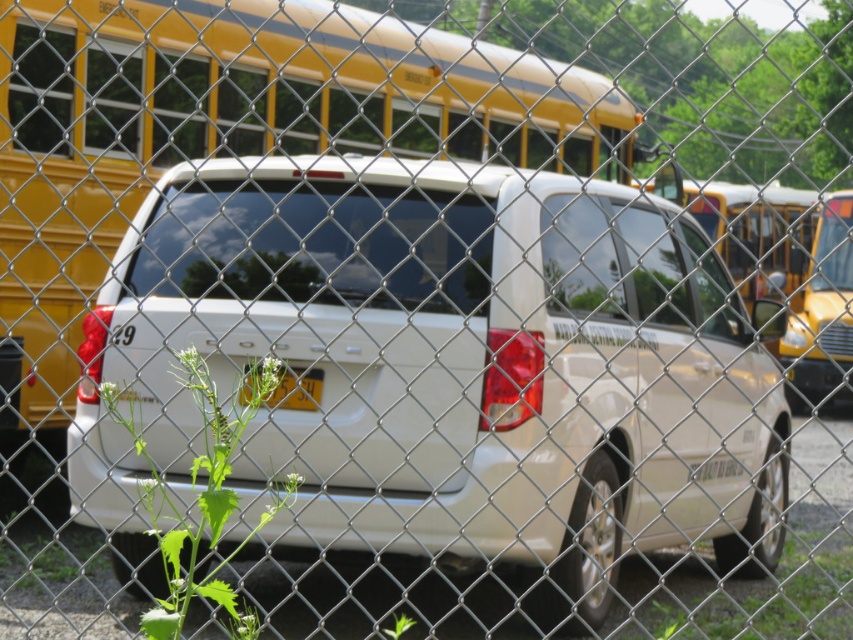
Question: Among these points, which one is farthest from the camera?

Choices:
 (A) (228, 557)
 (B) (378, 452)
 (C) (247, 387)
 (D) (38, 109)

Answer: (D)

Question: Considering the relative positions of white matte van at center and yellow plastic license plate at center in the image provided, where is white matte van at center located with respect to yellow plastic license plate at center?

Choices:
 (A) below
 (B) above

Answer: (A)

Question: Which point appears closest to the camera in this image?

Choices:
 (A) (347, 448)
 (B) (287, 380)
 (C) (844, 316)

Answer: (A)

Question: Considering the real-world distances, which object is farthest from the green leafy plant at lower left?

Choices:
 (A) yellow plastic license plate at center
 (B) yellow matte/satin school bus at center

Answer: (B)

Question: Can you confirm if yellow matte bus at upper left is smaller than yellow plastic license plate at center?

Choices:
 (A) no
 (B) yes

Answer: (A)

Question: Is yellow matte bus at upper left bigger than yellow matte/satin school bus at center?

Choices:
 (A) yes
 (B) no

Answer: (B)